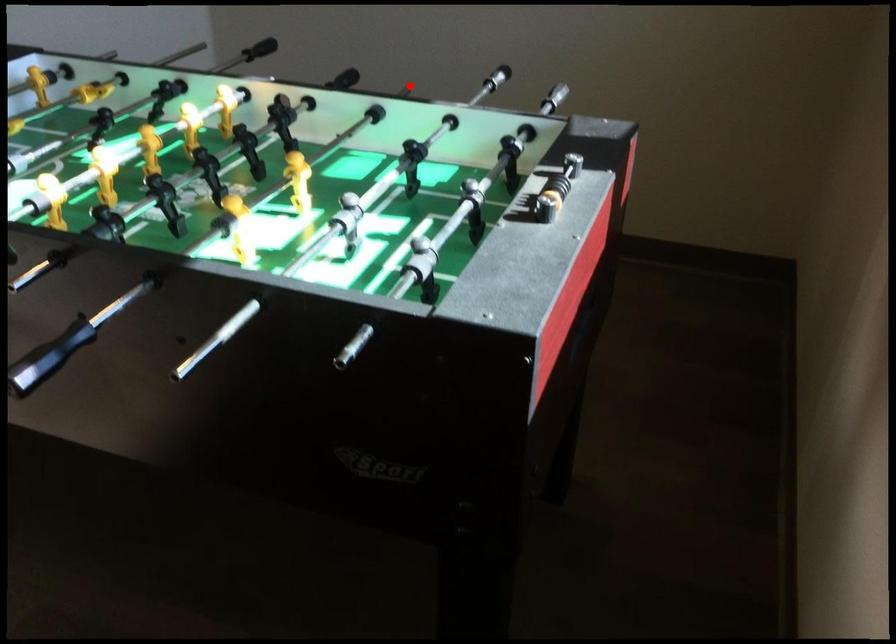
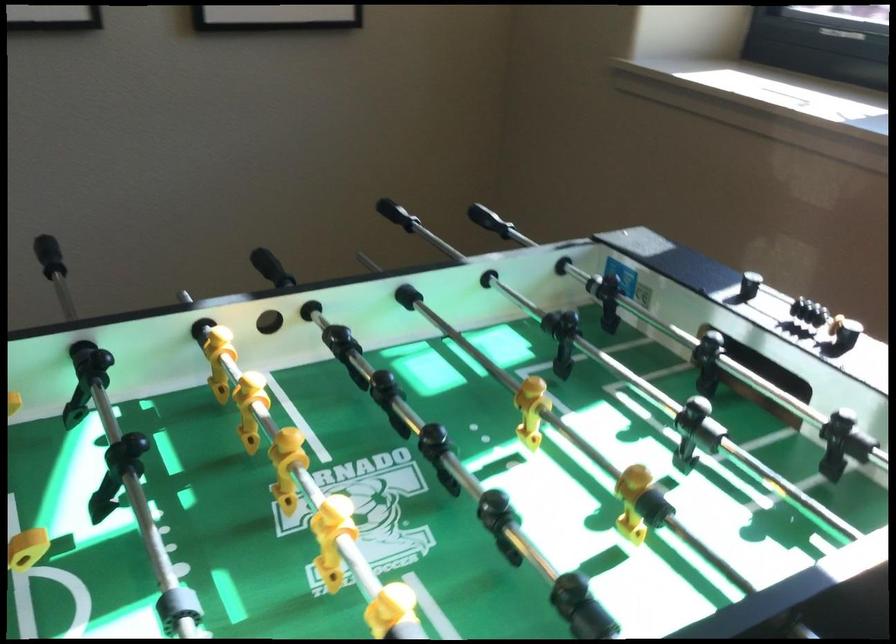
Question: I am providing you with two images of the same scene from different viewpoints. Given a red point in image1, look at the same physical point in image2. Is it:

Choices:
 (A) Closer to the viewpoint
 (B) Farther from the viewpoint

Answer: (A)